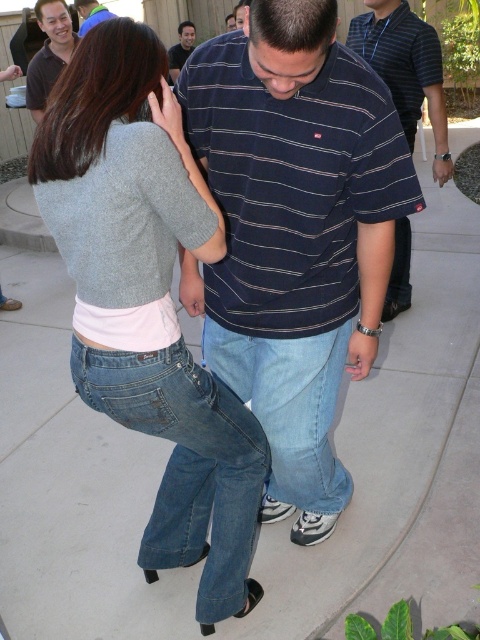
Question: Among these points, which one is farthest from the camera?

Choices:
 (A) (104, 10)
 (B) (301, 394)
 (C) (32, 86)
 (D) (287, 413)

Answer: (A)

Question: Among these objects, which one is nearest to the camera?

Choices:
 (A) denim jeans at lower center
 (B) denim jeans at center

Answer: (B)

Question: Among these objects, which one is farthest from the camera?

Choices:
 (A) matte black polo shirt at upper left
 (B) light blue denim jeans at center
 (C) dark blue striped shirt at center
 (D) matte blue shirt at upper center

Answer: (D)

Question: Can you confirm if denim jeans at center is positioned below matte blue shirt at upper center?

Choices:
 (A) no
 (B) yes

Answer: (B)

Question: Does denim jeans at center come in front of matte black polo shirt at upper left?

Choices:
 (A) yes
 (B) no

Answer: (A)

Question: Is dark blue striped polo shirt at center further to camera compared to matte blue shirt at upper center?

Choices:
 (A) yes
 (B) no

Answer: (A)